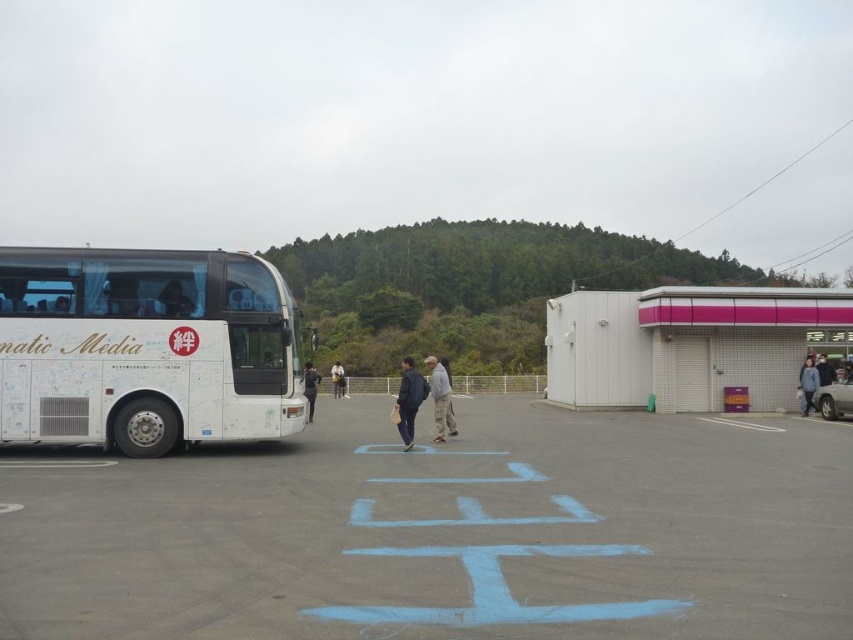
Question: Is gray camouflage pants at center bigger than dark gray fabric jacket at right?

Choices:
 (A) no
 (B) yes

Answer: (B)

Question: Among these objects, which one is nearest to the camera?

Choices:
 (A) gray camouflage pants at center
 (B) white asphalt parking lot at center
 (C) black fabric jacket at center

Answer: (B)

Question: Does dark blue fabric jacket at center have a smaller size compared to light brown leather jacket at center?

Choices:
 (A) yes
 (B) no

Answer: (B)

Question: Which point is closer to the camera?

Choices:
 (A) gray camouflage pants at center
 (B) white matte bus at left
 (C) dark gray fabric jacket at right

Answer: (B)

Question: Which object appears closest to the camera in this image?

Choices:
 (A) gray camouflage pants at center
 (B) black fabric jacket at center
 (C) dark gray fabric jacket at right
 (D) white asphalt parking lot at center

Answer: (D)

Question: Is white matte bus at left positioned in front of gray camouflage pants at center?

Choices:
 (A) yes
 (B) no

Answer: (A)